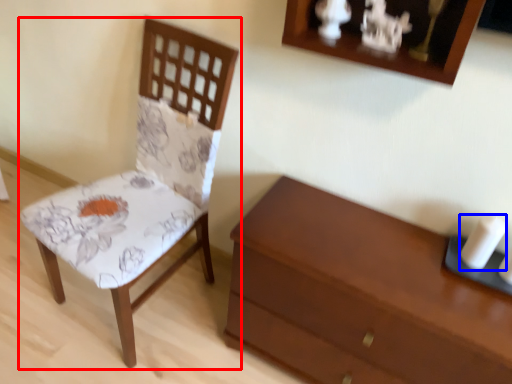
Question: Among these objects, which one is nearest to the camera, chair (highlighted by a red box) or candle (highlighted by a blue box)?

Choices:
 (A) chair
 (B) candle

Answer: (A)